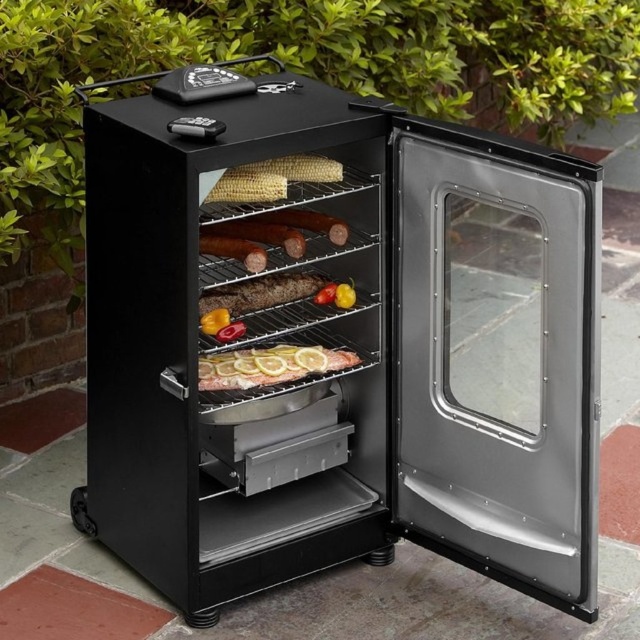
Is yellow matte corn at upper center to the left of smokey brown sausage at center from the viewer's perspective?

Incorrect, yellow matte corn at upper center is not on the left side of smokey brown sausage at center.

Is point (204, 198) farther from viewer compared to point (244, 241)?

No, it is not.

In order to click on yellow matte corn at upper center in this screenshot , I will do `click(248, 186)`.

Does point (248, 365) lie behind point (230, 196)?

That is True.

Between point (227, 387) and point (280, 188), which one is positioned behind?

The point (227, 387) is behind.

Who is more forward, (269, 381) or (227, 182)?

Point (227, 182) is in front.

The width and height of the screenshot is (640, 640). Find the location of `slightly translucent glass fish at center`. slightly translucent glass fish at center is located at coordinates (269, 365).

Can you confirm if slightly translucent glass fish at center is positioned below smokey brown sausage at center?

Yes, slightly translucent glass fish at center is below smokey brown sausage at center.

Locate an element on the screen. The height and width of the screenshot is (640, 640). slightly translucent glass fish at center is located at coordinates (269, 365).

I want to click on slightly translucent glass fish at center, so click(x=269, y=365).